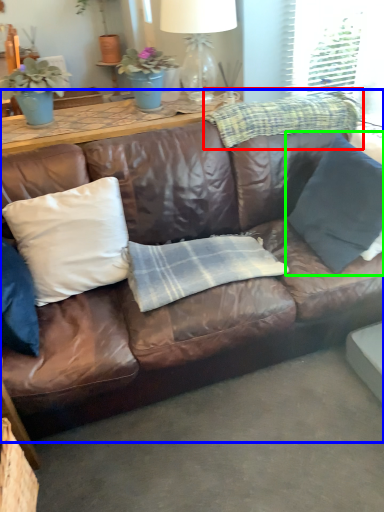
Question: Considering the real-world distances, which object is closest to plaid (highlighted by a red box)? studio couch (highlighted by a blue box) or pillow (highlighted by a green box).

Choices:
 (A) studio couch
 (B) pillow

Answer: (B)